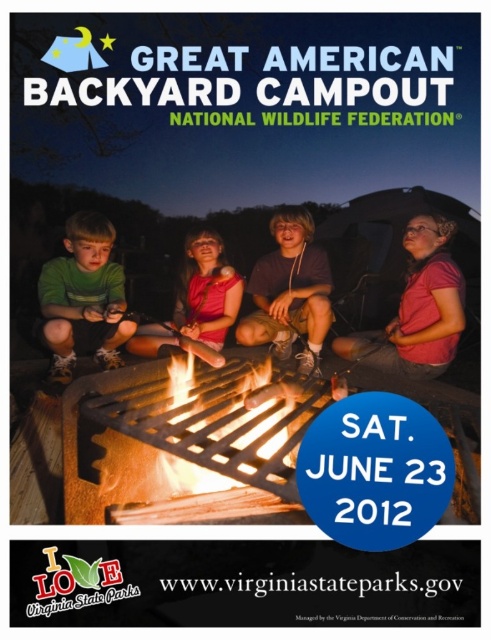
You are a photographer taking a picture of the campfire scene. You notice two shirts at the center of the image labeled as pink fabric shirt at center and matte pink shirt at center. Which shirt is closer to the camera?

The pink fabric shirt at center is positioned under the matte pink shirt at center, so the matte pink shirt at center is closer to the camera.

You are a photographer taking a picture of the campfire scene. You notice two shirts in the center of the image, a pink fabric shirt at center and a green matte shirt at center. Which shirt should you focus on to ensure it takes up more space in the photo?

The pink fabric shirt at center has a larger width than the green matte shirt at center, so focusing on it will ensure it takes up more space in the photo.